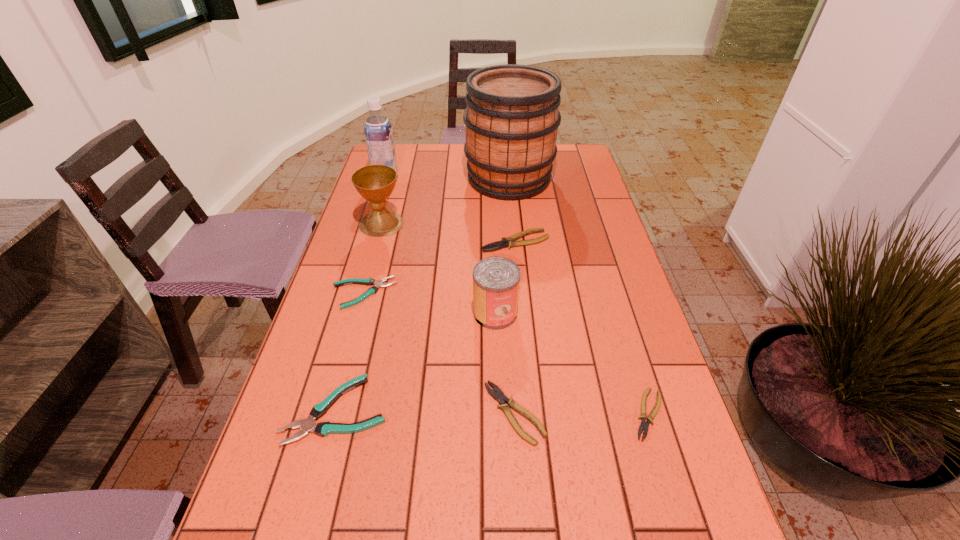
Find the location of a particular element. the second farthest pliers is located at coordinates pyautogui.click(x=372, y=290).

The image size is (960, 540). What are the coordinates of `the rightmost object` in the screenshot? It's located at (644, 425).

Locate an element on the screen. This screenshot has height=540, width=960. the rightmost yellow pliers is located at coordinates (644, 425).

The height and width of the screenshot is (540, 960). In order to click on vacant space situated on the left of the tallest object in this screenshot , I will do `click(440, 179)`.

In order to click on vacant space located 0.070m on the label of the second tallest object in this screenshot , I will do `click(418, 179)`.

Where is `blank space located 0.200m on the front of the third tallest object`? The image size is (960, 540). blank space located 0.200m on the front of the third tallest object is located at coordinates (366, 283).

This screenshot has height=540, width=960. Find the location of `vacant area located 0.130m on the left of the fourth tallest object`. vacant area located 0.130m on the left of the fourth tallest object is located at coordinates (421, 313).

Locate an element on the screen. blank space located 0.370m on the back of the farthest pliers is located at coordinates (509, 170).

The width and height of the screenshot is (960, 540). I want to click on vacant space situated 0.380m on the right of the bigger teal pliers, so click(x=572, y=410).

Locate an element on the screen. free space located 0.310m on the back of the second smallest yellow pliers is located at coordinates (506, 284).